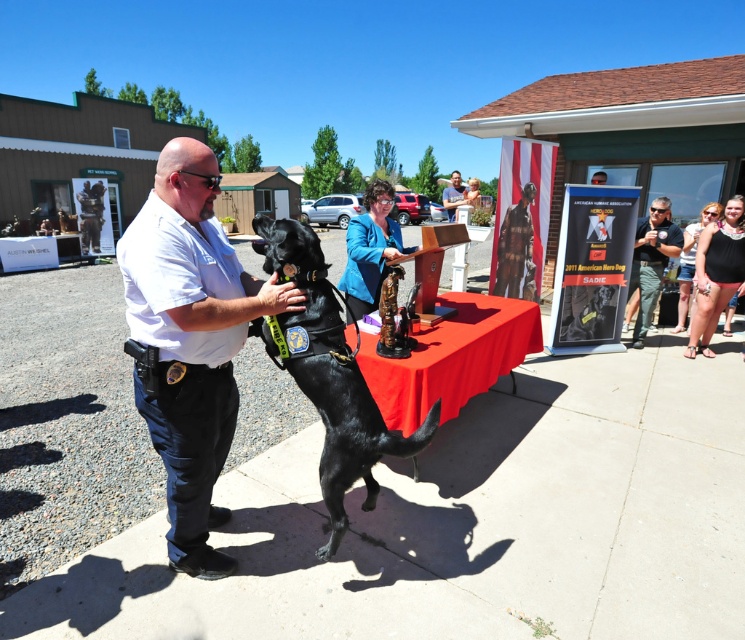
At what (x,y) coordinates should I click in order to perform the action: click on white uniform at center. Please return your answer as a coordinate pair (x, y). Looking at the image, I should click on (188, 340).

Is point (136, 387) positioned after point (340, 508)?

No.

The height and width of the screenshot is (640, 745). I want to click on white uniform at center, so click(x=188, y=340).

Is black matte dog at center further to the viewer compared to red cloth table at center?

No, it is in front of red cloth table at center.

Measure the distance from black matte dog at center to red cloth table at center.

3.29 feet

Who is more forward, [270,252] or [446,337]?

Positioned in front is point [270,252].

This screenshot has width=745, height=640. Identify the location of black matte dog at center. (326, 371).

Does point (288, 285) come in front of point (450, 182)?

Yes, it is in front of point (450, 182).

Does white uniform at center have a larger size compared to matte black uniform at center?

No, white uniform at center is not bigger than matte black uniform at center.

Identify the location of white uniform at center. (188, 340).

The width and height of the screenshot is (745, 640). I want to click on white uniform at center, so click(188, 340).